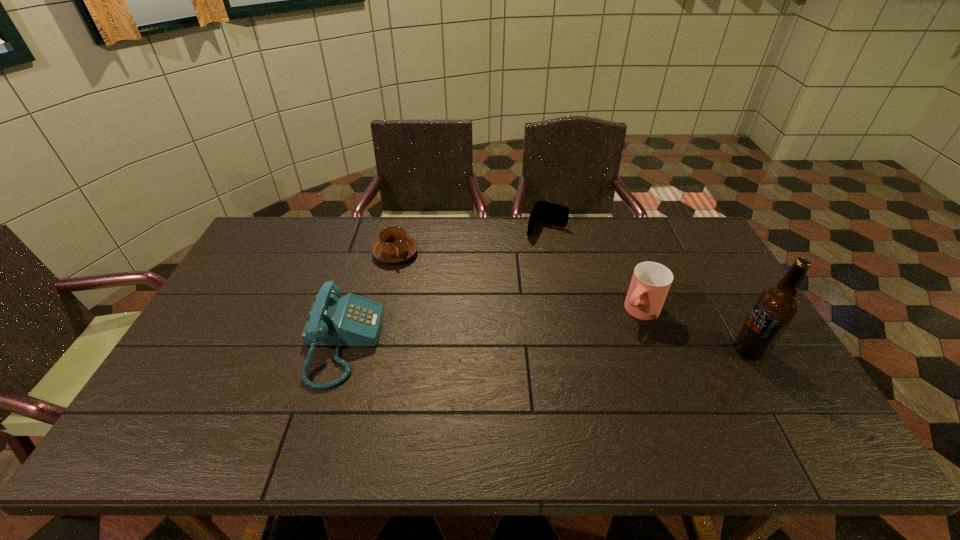
Find the location of a particular element. cappuccino that is at the far edge is located at coordinates (394, 245).

The height and width of the screenshot is (540, 960). Find the location of `wallet at the far edge`. wallet at the far edge is located at coordinates (543, 211).

Where is `object present at the near edge`? object present at the near edge is located at coordinates (352, 320).

At what (x,y) coordinates should I click in order to perform the action: click on object located in the right edge section of the desktop. Please return your answer as a coordinate pair (x, y). Image resolution: width=960 pixels, height=540 pixels. Looking at the image, I should click on (775, 308).

This screenshot has width=960, height=540. I want to click on free space at the far edge of the desktop, so click(x=309, y=237).

Identify the location of free space at the near edge of the desktop. The image size is (960, 540). click(x=280, y=399).

The image size is (960, 540). Identify the location of free space at the left edge of the desktop. (253, 297).

Find the location of a particular element. free region at the right edge of the desktop is located at coordinates (732, 294).

The image size is (960, 540). In the image, there is a desktop. Identify the location of blank space at the far left corner. (262, 255).

At what (x,y) coordinates should I click in order to perform the action: click on vacant space at the far right corner. Please return your answer as a coordinate pair (x, y). The height and width of the screenshot is (540, 960). Looking at the image, I should click on (684, 218).